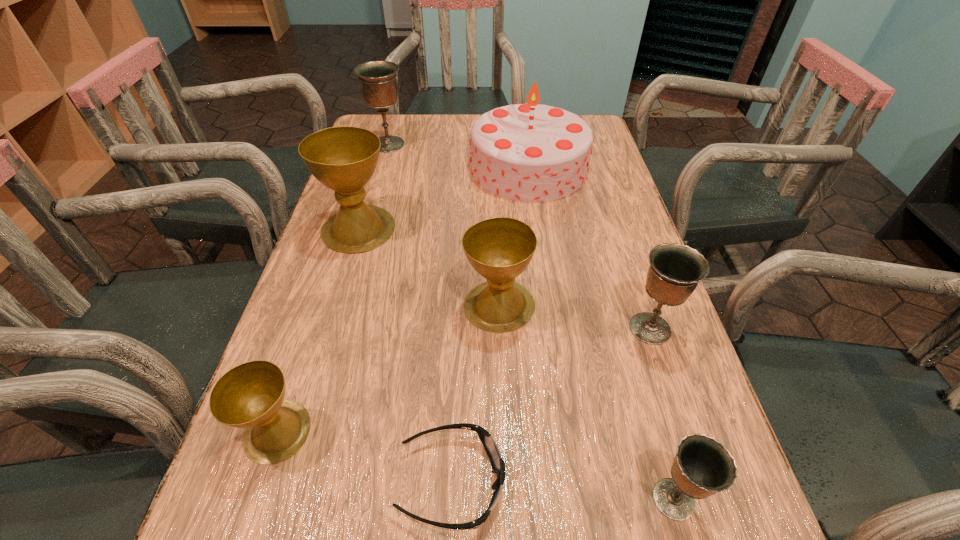
At what (x,y) coordinates should I click in order to perform the action: click on free space located on the lenses of the shortest object. Please return your answer as a coordinate pair (x, y). The height and width of the screenshot is (540, 960). Looking at the image, I should click on (585, 482).

Locate an element on the screen. birthday cake that is at the far edge is located at coordinates (531, 152).

You are a GUI agent. You are given a task and a screenshot of the screen. Output one action in this format:
    pyautogui.click(x=<x>, y=<y>)
    Task: Click on the chalice that is at the far edge
    This screenshot has width=960, height=540.
    Given the screenshot: What is the action you would take?
    pyautogui.click(x=378, y=82)

Locate an element on the screen. birthday cake that is at the right edge is located at coordinates (531, 152).

This screenshot has height=540, width=960. I want to click on object located at the far left corner, so point(378,82).

Locate an element on the screen. object present at the far right corner is located at coordinates (531, 152).

Locate an element on the screen. vacant space at the left edge of the desktop is located at coordinates (322, 271).

Find the location of a particular element. Image resolution: width=960 pixels, height=540 pixels. free region at the right edge of the desktop is located at coordinates (657, 399).

Image resolution: width=960 pixels, height=540 pixels. I want to click on vacant space at the far left corner of the desktop, so 413,114.

This screenshot has width=960, height=540. I want to click on free spot at the far right corner of the desktop, so click(x=603, y=146).